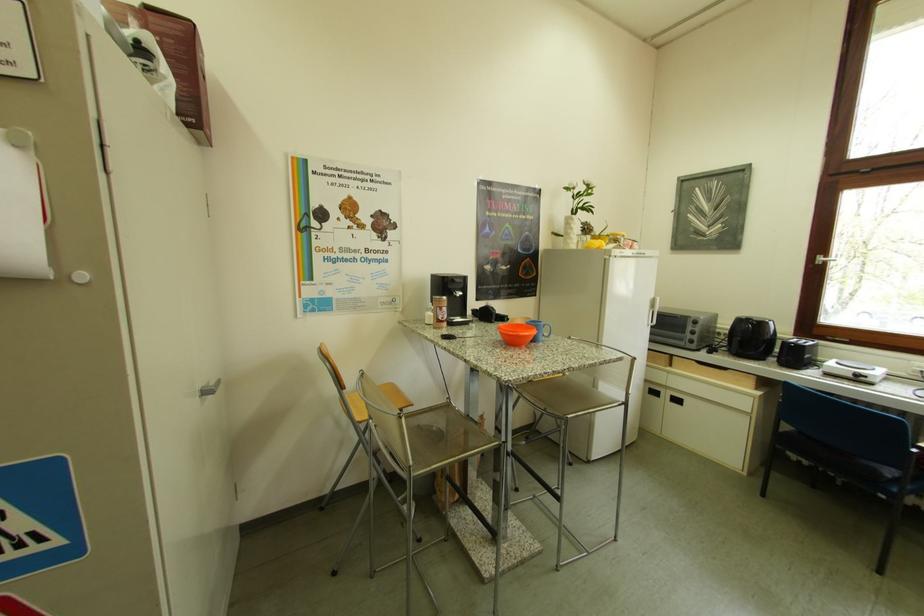
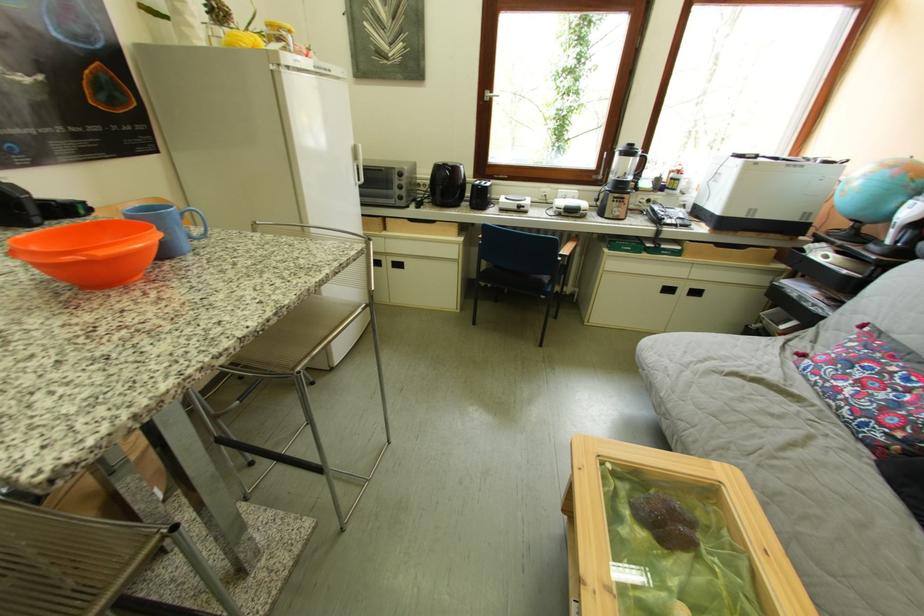
Locate, in the second image, the point that corresponds to (x=677, y=398) in the first image.

(399, 265)